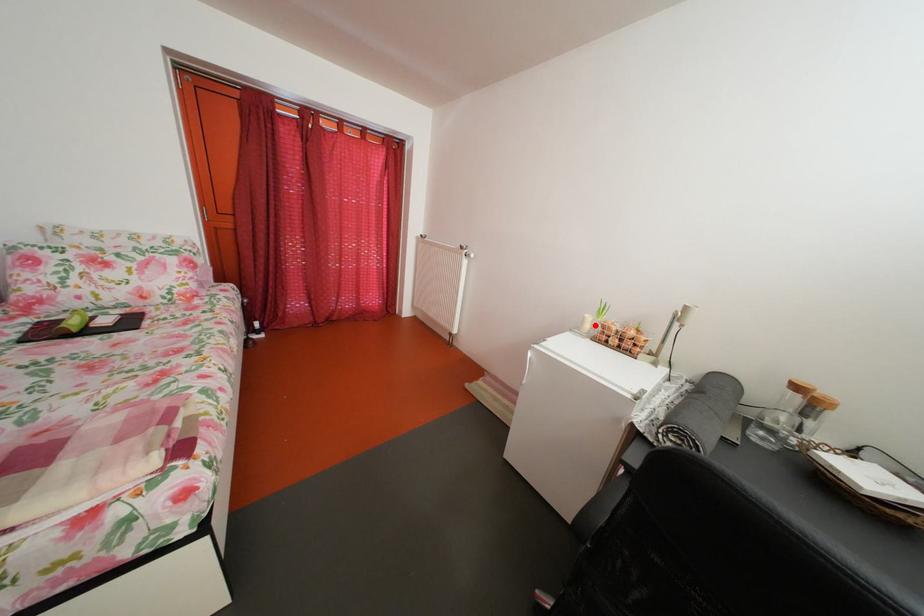
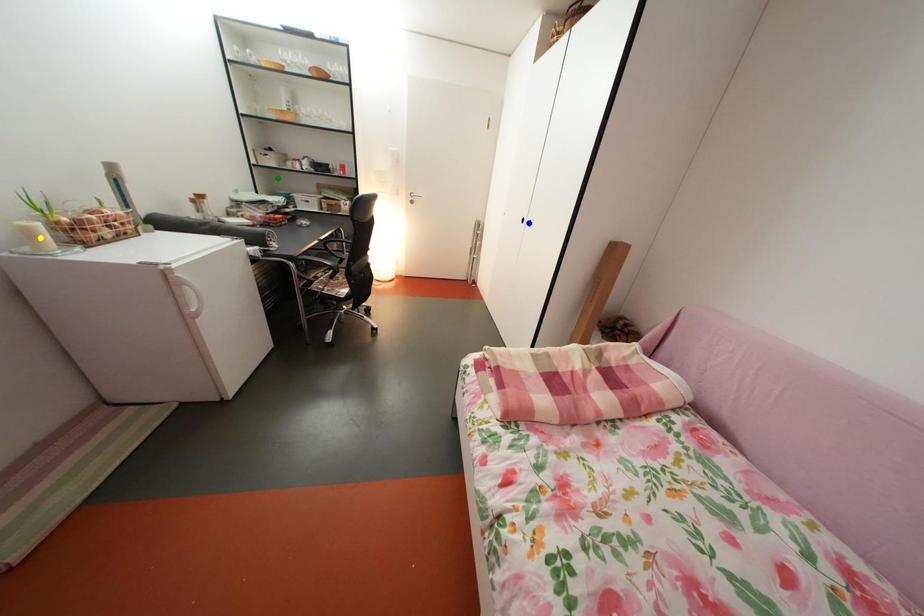
Question: I am providing you with two images of the same scene from different viewpoints. A red point is marked on the first image. You are given multiple points on the second image. Which mark in image 2 goes with the point in image 1?

Choices:
 (A) blue point
 (B) green point
 (C) yellow point

Answer: (C)